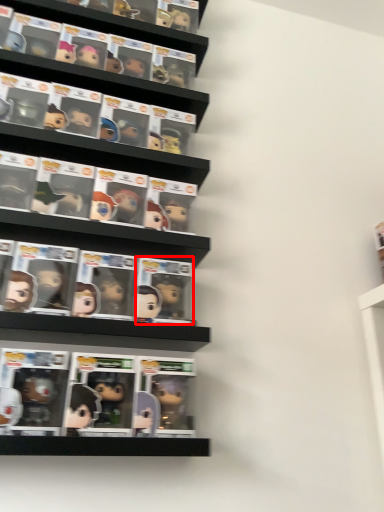
Question: Where is comic book (annotated by the red box) located in relation to comic book in the image?

Choices:
 (A) left
 (B) right

Answer: (B)